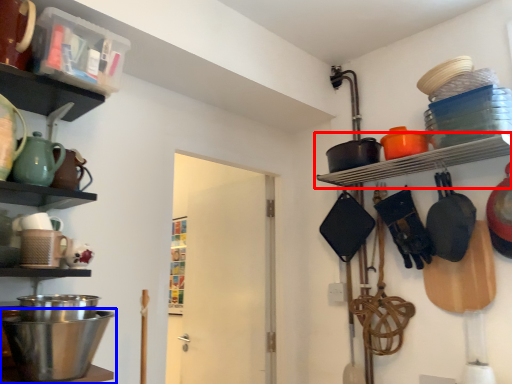
Question: Which object is closer to the camera taking this photo, shelf (highlighted by a red box) or mixing bowl (highlighted by a blue box)?

Choices:
 (A) shelf
 (B) mixing bowl

Answer: (B)